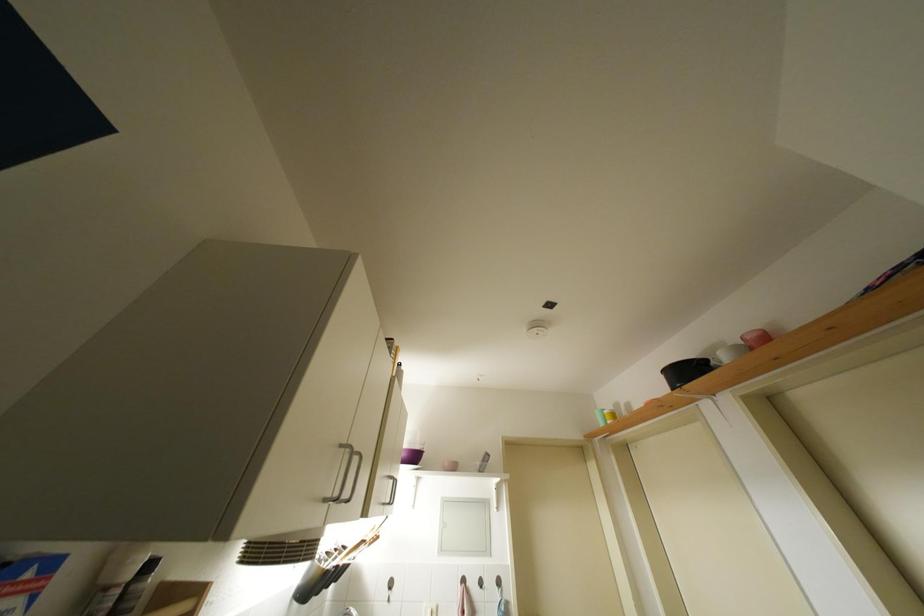
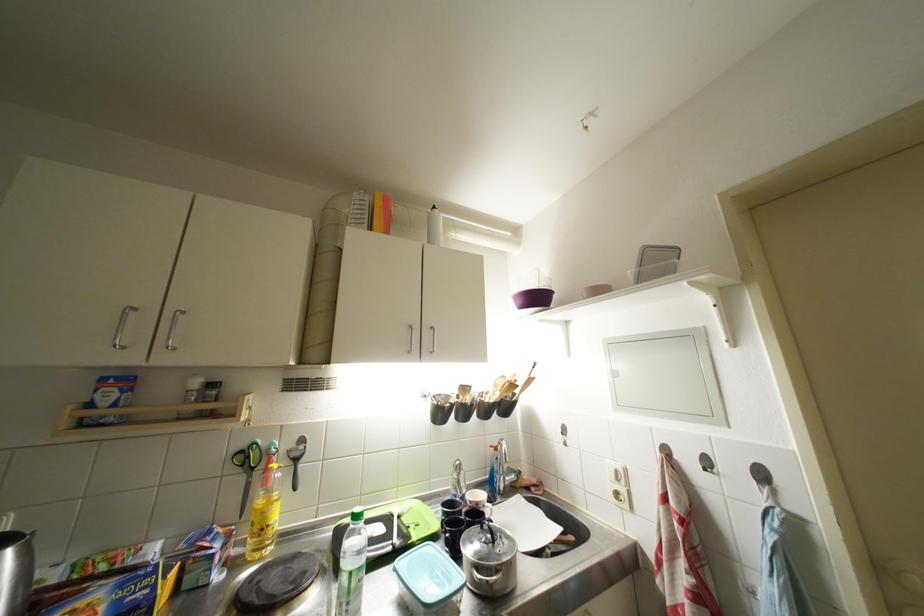
In the second image, find the point that corresponds to point (505, 586) in the first image.

(769, 479)